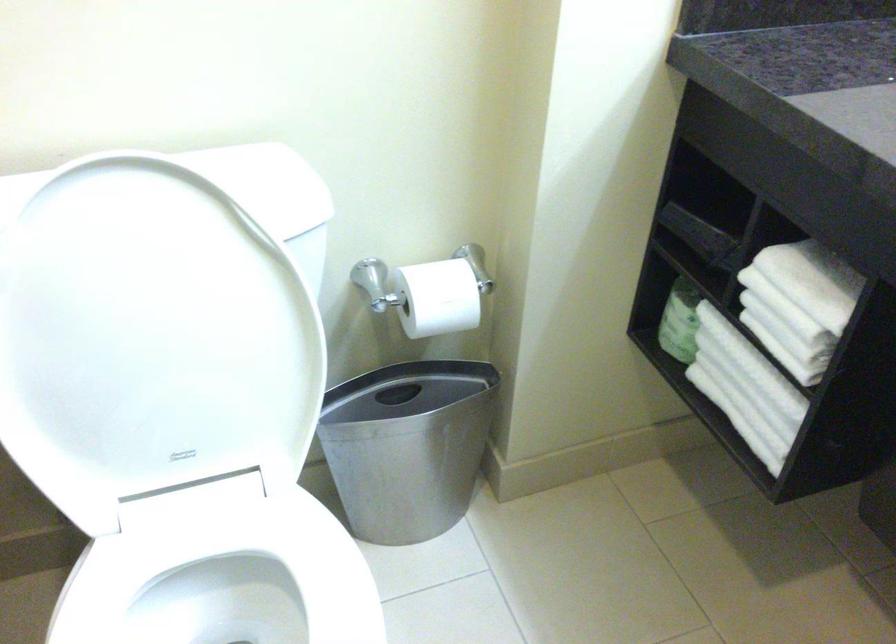
Describe the element at coordinates (159, 323) in the screenshot. Image resolution: width=896 pixels, height=644 pixels. I see `the white toilet lid` at that location.